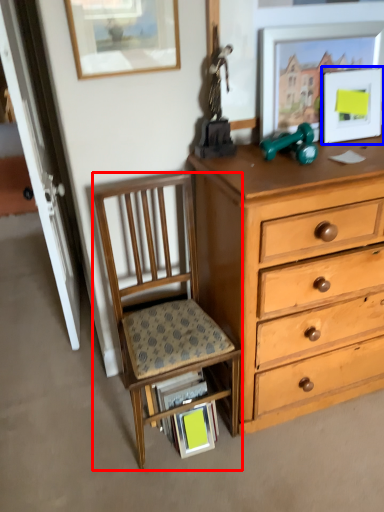
Question: Which point is further to the camera, chair (highlighted by a red box) or picture frame (highlighted by a blue box)?

Choices:
 (A) chair
 (B) picture frame

Answer: (B)